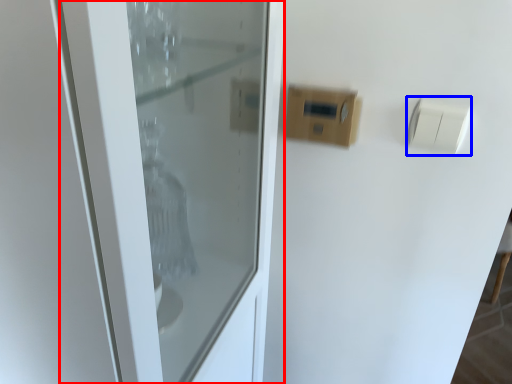
Question: Which object is further to the camera taking this photo, door (highlighted by a red box) or light switch (highlighted by a blue box)?

Choices:
 (A) door
 (B) light switch

Answer: (B)